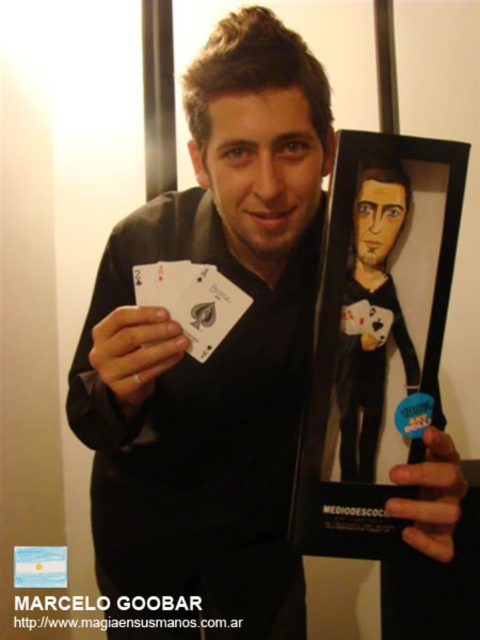
You are a delivery person who needs to place a small package between the matte black cards at center and the black paper at center. The package is 4 inches long. Can you fit it between them without moving either object?

The distance between the matte black cards at center and the black paper at center is 8.18 inches. Since the package is 4 inches long, which is less than the space available, you can fit it between them without moving either object.

You are a magician preparing for a performance. You have two items at center stage, the matte black cards at center and the black paper playing cards at center. Which one is easier to bend without breaking?

The matte black cards at center is thinner than black paper playing cards at center, so the matte black cards at center would be easier to bend without breaking since they are thinner.